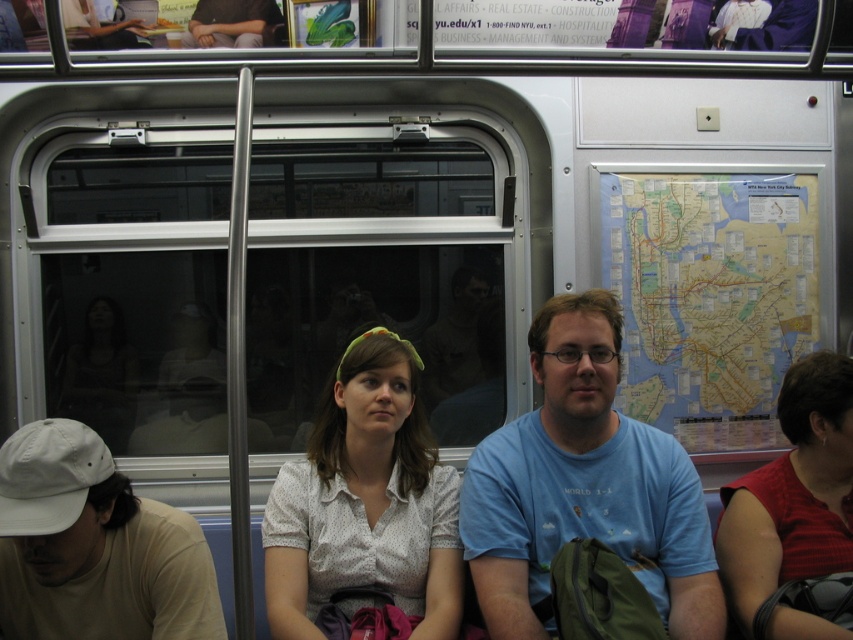
You are standing on the subway car and want to ask the person in the matte black shirt at center a question. Which direction should you move to approach them from the matte red shirt at right?

The matte red shirt at right is closer to the viewer than the matte black shirt at center, so to approach the matte black shirt at center from the matte red shirt at right, you should move towards the center of the subway car away from the edge where the matte red shirt is positioned.